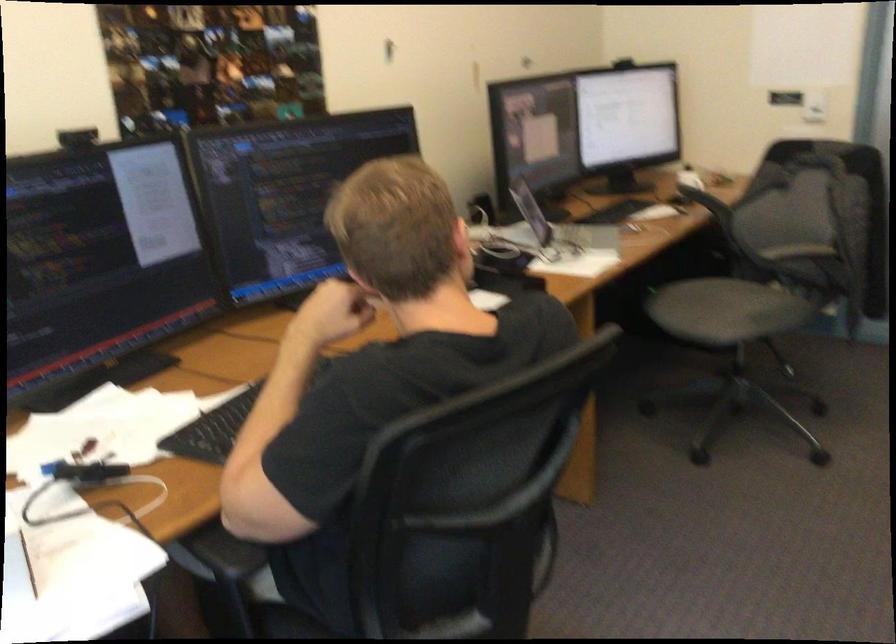
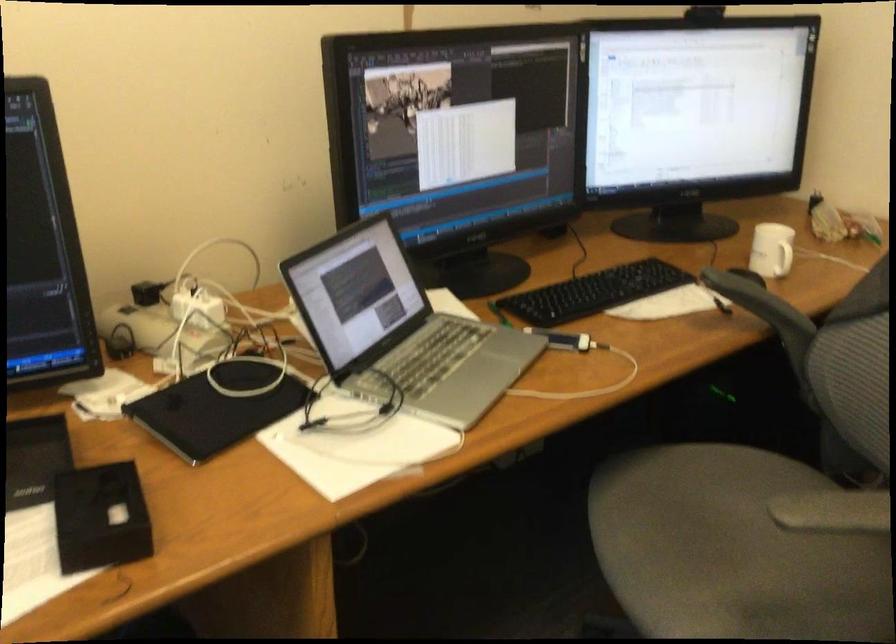
Question: I am providing you with two images of the same scene from different viewpoints. Please identify which objects are invisible in image2.

Choices:
 (A) chair sitting surface
 (B) black webcam
 (C) small black box
 (D) none of these

Answer: (D)